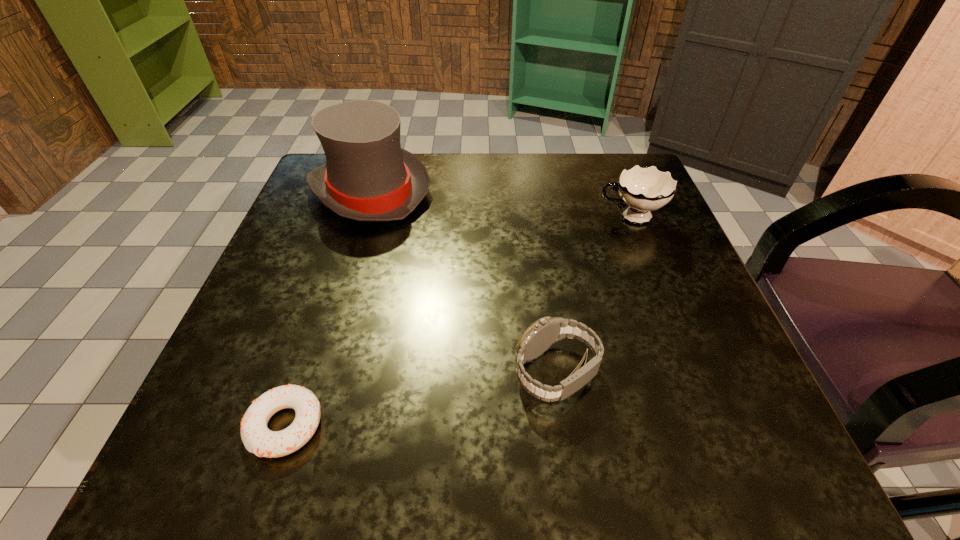
Locate an element on the screen. The width and height of the screenshot is (960, 540). dress hat is located at coordinates (368, 177).

Identify the location of cup. The image size is (960, 540). (644, 189).

Find the location of a particular element. This screenshot has width=960, height=540. the third object from left to right is located at coordinates (545, 332).

The width and height of the screenshot is (960, 540). What are the coordinates of `doughnut` in the screenshot? It's located at (257, 438).

Identify the location of vacant space positioned on the right of the dress hat. This screenshot has width=960, height=540. (554, 191).

Identify the location of free spot located 0.100m on the side of the rightmost object with the handle. This screenshot has width=960, height=540. (546, 217).

Identify the location of free region located 0.090m on the side of the rightmost object with the handle. (551, 217).

At what (x,y) coordinates should I click in order to perform the action: click on vacant point located on the side of the rightmost object with the handle. Please return your answer as a coordinate pair (x, y). The width and height of the screenshot is (960, 540). Looking at the image, I should click on click(520, 217).

Locate an element on the screen. The width and height of the screenshot is (960, 540). free spot located 0.160m on the face of the second object from right to left is located at coordinates (402, 373).

This screenshot has height=540, width=960. What are the coordinates of `free space located on the face of the second object from right to left` in the screenshot? It's located at (346, 373).